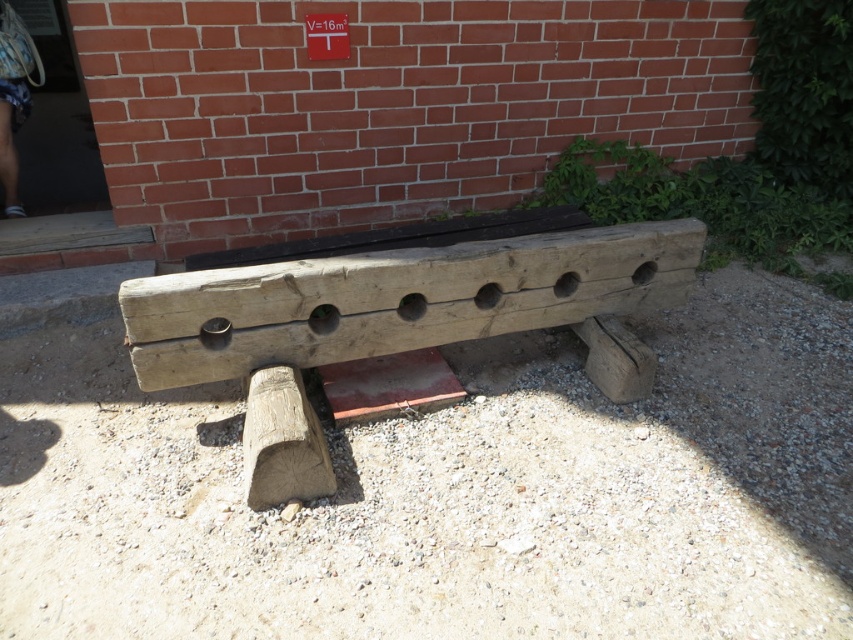
You are standing 5 feet away from the natural stone gravel at center. Can you reach it without moving your feet?

The natural stone gravel at center is 5.12 feet away from you, so you cannot reach it without moving your feet since it is slightly farther than 5 feet.

You are a landscape architect designing a garden pathway. You have two materials to choose from at the center of the area. Which material has a greater width between them? The options are the natural stone gravel at center and the natural wood bench at center.

The natural stone gravel at center has a larger width than the natural wood bench at center, so the natural stone gravel at center is the correct choice for a wider material.

You are a tourist visiting an historical site and see the natural stone gravel at center and the natural wood bench at center. Which object is closer to you?

The natural stone gravel at center is closer to you because it is in front of the natural wood bench at center.